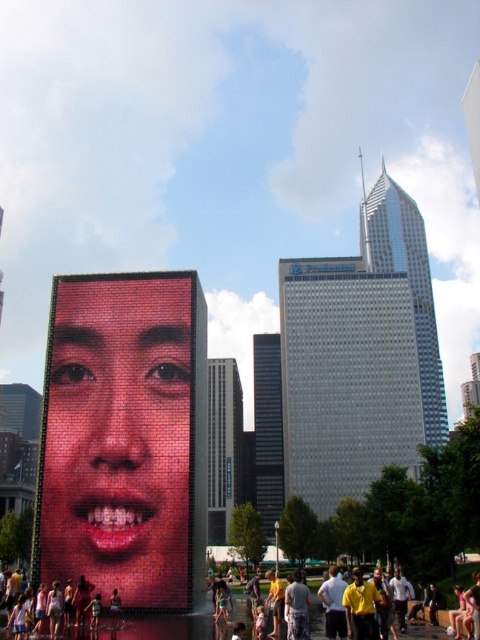
You are an artist analyzing the digital display screen. You notice the matte pink lips at center and the matte black face at center. Which of these two elements is shorter in height?

The matte pink lips at center is not as tall as matte black face at center, so the matte pink lips at center is shorter in height.